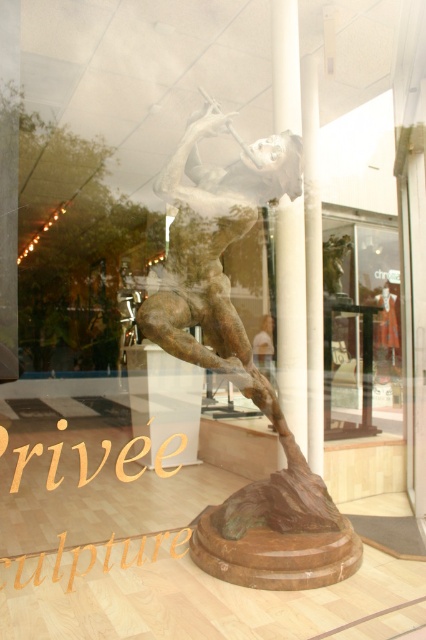
You are a security guard in the gallery. You notice a visitor trying to touch the bronze sculpture at center. You need to stop them but want to explain why the clear glass display at center is there. What would you say?

The bronze sculpture at center is above the clear glass display at center, which acts as a protective barrier to prevent direct contact and ensure the sculpture remains undamaged.

You are a visitor in the gallery and want to take a photo of the bronze sculpture at center without any reflections from the clear glass display at center. Where should you stand relative to the sculpture and the display?

The bronze sculpture at center is on the left side of the clear glass display at center. To avoid reflections, you should stand to the right side of the sculpture so that the display is between you and any reflective surfaces, minimizing glare.